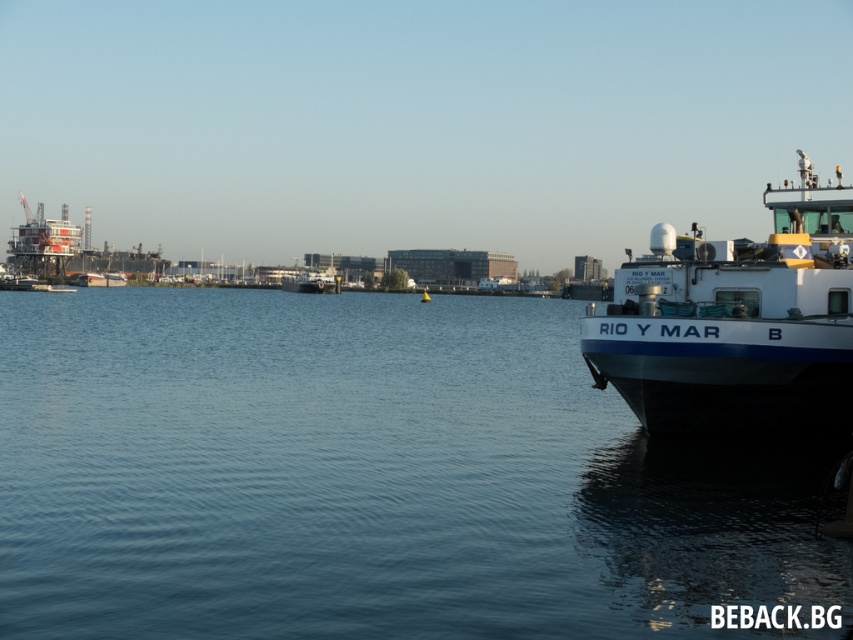
Question: Can you confirm if blue water at center is wider than reddish metallic structure at upper left?

Choices:
 (A) yes
 (B) no

Answer: (A)

Question: Is white matte boat at right below reddish metallic structure at upper left?

Choices:
 (A) yes
 (B) no

Answer: (A)

Question: Which point is farther from the camera taking this photo?

Choices:
 (A) (790, 305)
 (B) (322, 416)
 (C) (73, 225)

Answer: (C)

Question: Is blue water at center thinner than reddish metallic structure at upper left?

Choices:
 (A) no
 (B) yes

Answer: (A)

Question: Which object appears closest to the camera in this image?

Choices:
 (A) white matte boat at right
 (B) reddish metallic structure at upper left
 (C) blue water at center

Answer: (C)

Question: Which point appears farthest from the camera in this image?

Choices:
 (A) (532, 397)
 (B) (73, 246)
 (C) (605, 321)

Answer: (B)